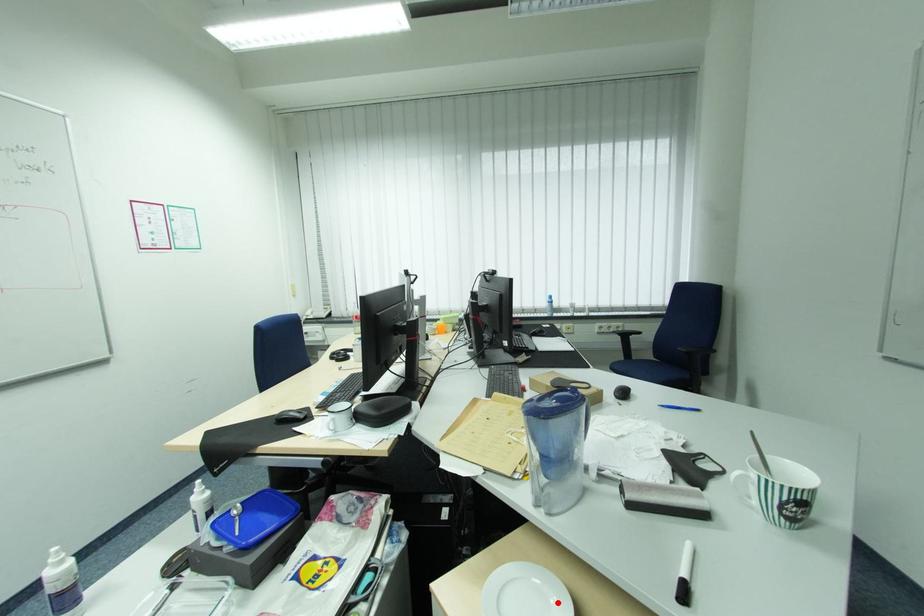
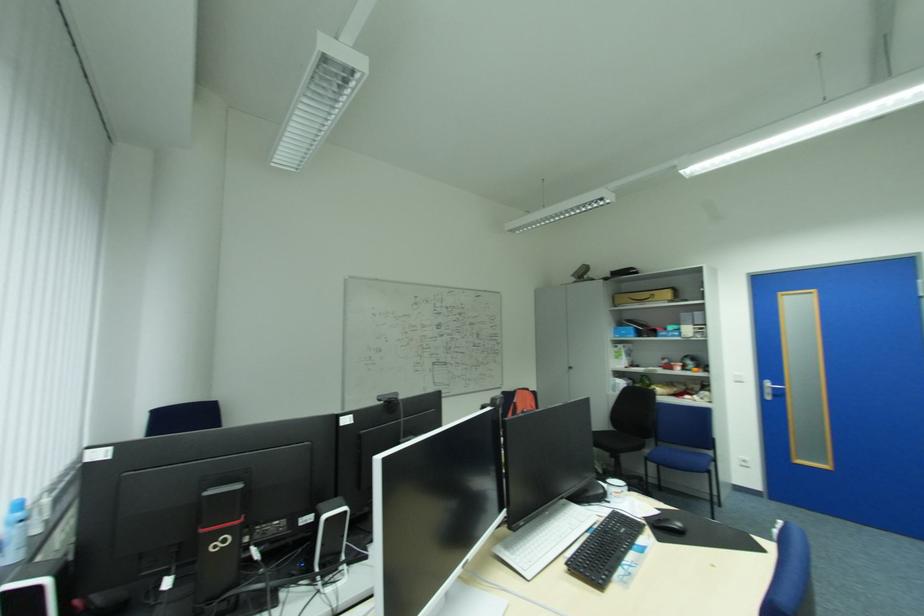
Question: I am providing you with two images of the same scene from different viewpoints. A red point is marked on the first image. Is the red point's position out of view in image 2?

Choices:
 (A) Yes
 (B) No

Answer: (A)